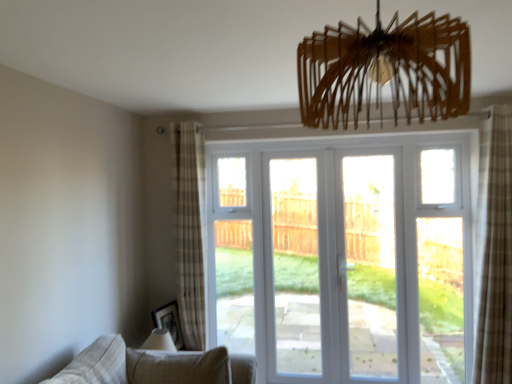
Question: From a real-world perspective, is white glossy door at center, which is the second screen door in left-to-right order, positioned above or below wooden chandelier at upper center?

Choices:
 (A) below
 (B) above

Answer: (A)

Question: Would you say white glossy door at center, which is the second screen door in left-to-right order, is to the left or to the right of wooden chandelier at upper center in the picture?

Choices:
 (A) left
 (B) right

Answer: (B)

Question: Based on their relative distances, which object is farther from the white glossy door at center, the first screen door from the right?

Choices:
 (A) white glossy door at center
 (B) white glass door at center, the first screen door positioned from the left
 (C) wooden chandelier at upper center
 (D) matte black picture frame at lower left
 (E) beige fabric couch at lower left

Answer: (C)

Question: Which object is positioned farthest from the white glass door at center, the first screen door positioned from the left?

Choices:
 (A) wooden chandelier at upper center
 (B) brown plaid curtain at right, arranged as the second curtain when viewed from the left
 (C) beige fabric couch at lower left
 (D) white glossy door at center, which is the second screen door in left-to-right order
 (E) matte black picture frame at lower left

Answer: (A)